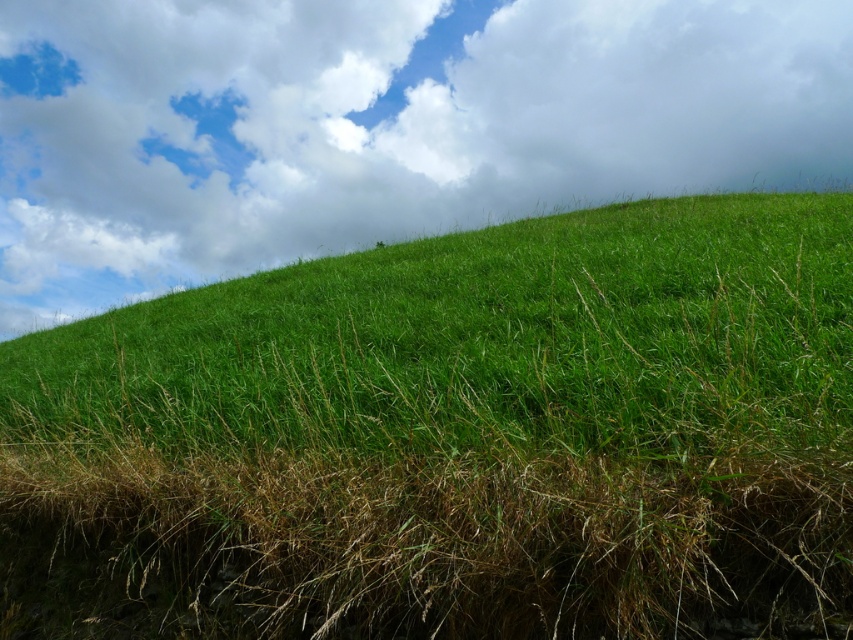
Does point (505, 365) come closer to viewer compared to point (316, 10)?

Yes, point (505, 365) is in front of point (316, 10).

Looking at this image, can you confirm if green grassy hill at center is thinner than white fluffy cloud at upper center?

Indeed, green grassy hill at center has a lesser width compared to white fluffy cloud at upper center.

Find the location of a particular element. green grassy hill at center is located at coordinates (454, 438).

Find the location of a particular element. Image resolution: width=853 pixels, height=640 pixels. green grassy hill at center is located at coordinates (454, 438).